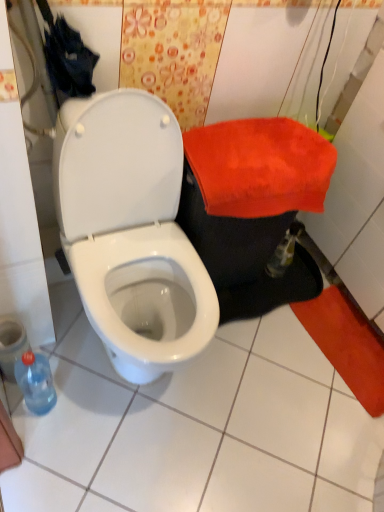
Question: Would you say red plush towel at right is outside translucent plastic bottle at lower left?

Choices:
 (A) no
 (B) yes

Answer: (B)

Question: Does red plush towel at right have a lesser width compared to translucent plastic bottle at lower left?

Choices:
 (A) yes
 (B) no

Answer: (B)

Question: Is red plush towel at right with translucent plastic bottle at lower left?

Choices:
 (A) yes
 (B) no

Answer: (B)

Question: From a real-world perspective, is red plush towel at right physically above translucent plastic bottle at lower left?

Choices:
 (A) yes
 (B) no

Answer: (A)

Question: Is translucent plastic bottle at lower left at the back of red plush towel at right?

Choices:
 (A) no
 (B) yes

Answer: (A)

Question: From their relative heights in the image, would you say white glossy toilet at center is taller or shorter than red plush towel at right?

Choices:
 (A) short
 (B) tall

Answer: (B)

Question: From the image's perspective, is white glossy toilet at center located above or below red plush towel at right?

Choices:
 (A) above
 (B) below

Answer: (B)

Question: Does point (158, 165) appear closer or farther from the camera than point (244, 207)?

Choices:
 (A) farther
 (B) closer

Answer: (B)

Question: From a real-world perspective, relative to red plush towel at right, is white glossy toilet at center vertically above or below?

Choices:
 (A) below
 (B) above

Answer: (A)

Question: Is point click(268, 175) closer or farther from the camera than point click(153, 170)?

Choices:
 (A) farther
 (B) closer

Answer: (A)

Question: From their relative heights in the image, would you say red plush towel at right is taller or shorter than white glossy toilet at center?

Choices:
 (A) tall
 (B) short

Answer: (B)

Question: Considering their positions, is red plush towel at right located in front of or behind white glossy toilet at center?

Choices:
 (A) behind
 (B) front

Answer: (A)

Question: In terms of width, does red plush towel at right look wider or thinner when compared to white glossy toilet at center?

Choices:
 (A) wide
 (B) thin

Answer: (B)

Question: Choose the correct answer: Is white glossy toilet at center inside translucent plastic bottle at lower left or outside it?

Choices:
 (A) outside
 (B) inside

Answer: (A)

Question: Considering the positions of white glossy toilet at center and translucent plastic bottle at lower left in the image, is white glossy toilet at center wider or thinner than translucent plastic bottle at lower left?

Choices:
 (A) wide
 (B) thin

Answer: (A)